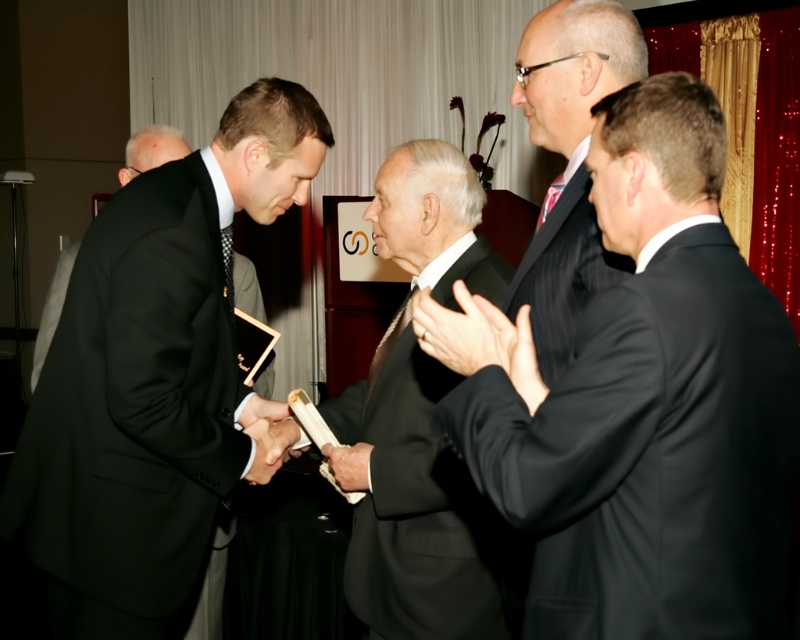
Is black satin suit at left smaller than matte black suit at center?

Incorrect, black satin suit at left is not smaller in size than matte black suit at center.

Where is `black satin suit at left`? The image size is (800, 640). black satin suit at left is located at coordinates (154, 380).

Locate an element on the screen. black satin suit at left is located at coordinates (154, 380).

Locate an element on the screen. Image resolution: width=800 pixels, height=640 pixels. pinstripe dark suit at right is located at coordinates (564, 275).

Does point (628, 260) lie behind point (264, 481)?

No, (628, 260) is in front of (264, 481).

The image size is (800, 640). In order to click on pinstripe dark suit at right in this screenshot , I will do `click(564, 275)`.

In the scene shown: Does pinstripe dark suit at right appear over smooth black glove at center?

Correct, pinstripe dark suit at right is located above smooth black glove at center.

Looking at this image, is pinstripe dark suit at right taller than smooth black glove at center?

Yes.

Where is `pinstripe dark suit at right`? pinstripe dark suit at right is located at coordinates (564, 275).